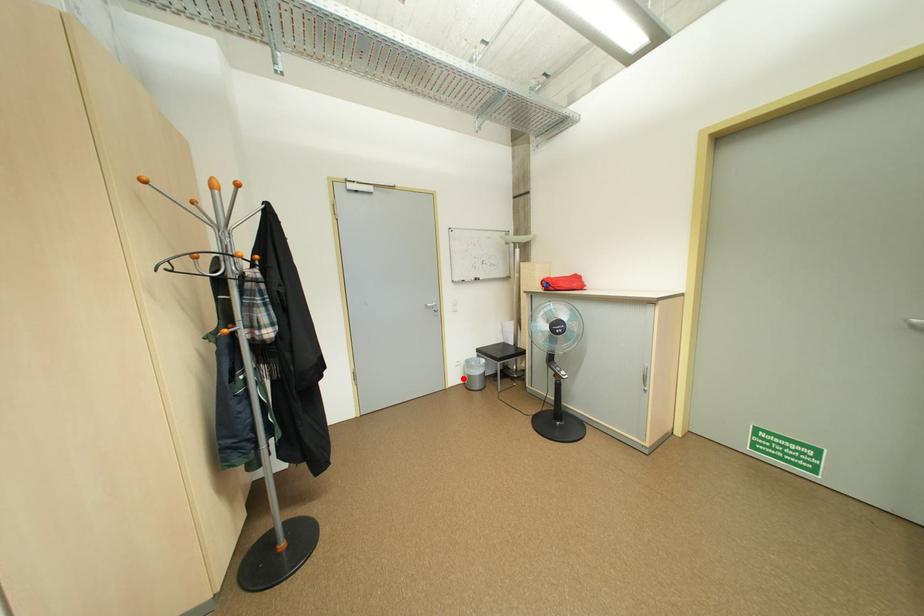
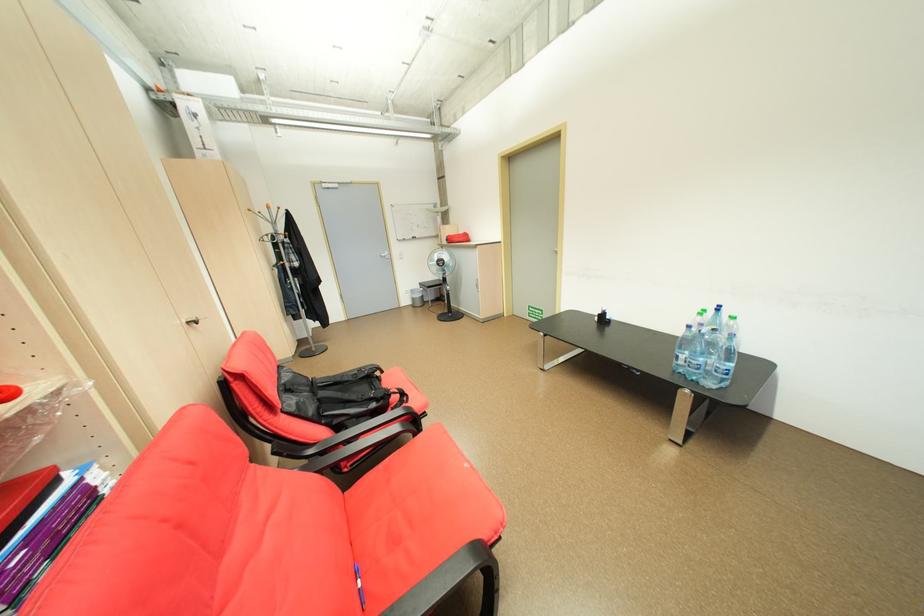
Find the pixel in the second image that matches the highlighted location in the first image.

(415, 302)